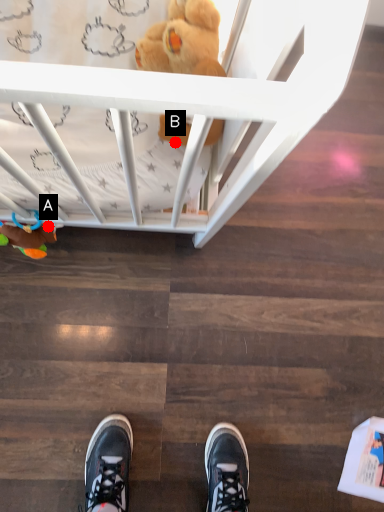
Question: Two points are circled on the image, labeled by A and B beside each circle. Which point appears closest to the camera in this image?

Choices:
 (A) A is closer
 (B) B is closer

Answer: (B)